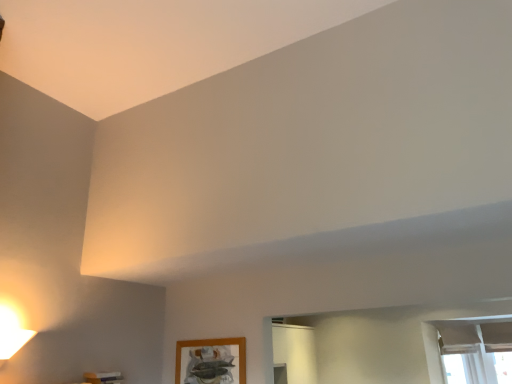
Question: Should I look upward or downward to see matte white remote at lower left?

Choices:
 (A) up
 (B) down

Answer: (B)

Question: From a real-world perspective, is wooden picture frame at lower center positioned over matte white remote at lower left based on gravity?

Choices:
 (A) yes
 (B) no

Answer: (A)

Question: Considering the relative sizes of wooden picture frame at lower center and matte white remote at lower left in the image provided, is wooden picture frame at lower center shorter than matte white remote at lower left?

Choices:
 (A) yes
 (B) no

Answer: (B)

Question: Can you confirm if wooden picture frame at lower center is taller than matte white remote at lower left?

Choices:
 (A) yes
 (B) no

Answer: (A)

Question: Considering the relative sizes of wooden picture frame at lower center and matte white remote at lower left in the image provided, is wooden picture frame at lower center wider than matte white remote at lower left?

Choices:
 (A) no
 (B) yes

Answer: (A)

Question: From the image's perspective, does wooden picture frame at lower center appear lower than matte white remote at lower left?

Choices:
 (A) yes
 (B) no

Answer: (A)

Question: Is wooden picture frame at lower center at the left side of matte white remote at lower left?

Choices:
 (A) yes
 (B) no

Answer: (B)

Question: From the image's perspective, is white sheer curtain at lower right under matte white remote at lower left?

Choices:
 (A) no
 (B) yes

Answer: (B)

Question: Is white sheer curtain at lower right positioned with its back to matte white remote at lower left?

Choices:
 (A) yes
 (B) no

Answer: (B)

Question: Is white sheer curtain at lower right at the left side of matte white remote at lower left?

Choices:
 (A) no
 (B) yes

Answer: (A)

Question: Is white sheer curtain at lower right completely or partially outside of matte white remote at lower left?

Choices:
 (A) yes
 (B) no

Answer: (A)

Question: Considering the relative sizes of white sheer curtain at lower right and matte white remote at lower left in the image provided, is white sheer curtain at lower right wider than matte white remote at lower left?

Choices:
 (A) no
 (B) yes

Answer: (B)

Question: From a real-world perspective, is white sheer curtain at lower right positioned under matte white remote at lower left based on gravity?

Choices:
 (A) yes
 (B) no

Answer: (B)

Question: Can you see matte white remote at lower left touching white sheer curtain at lower right?

Choices:
 (A) no
 (B) yes

Answer: (A)